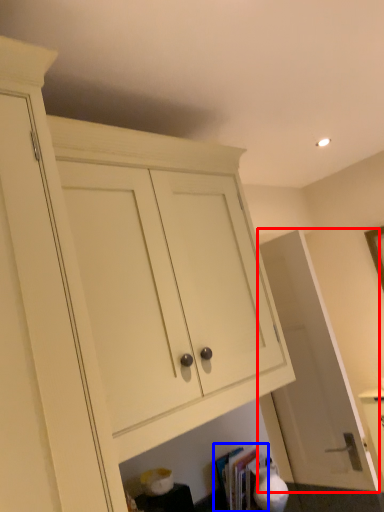
Question: Which point is further to the camera, door (highlighted by a red box) or book (highlighted by a blue box)?

Choices:
 (A) door
 (B) book

Answer: (A)